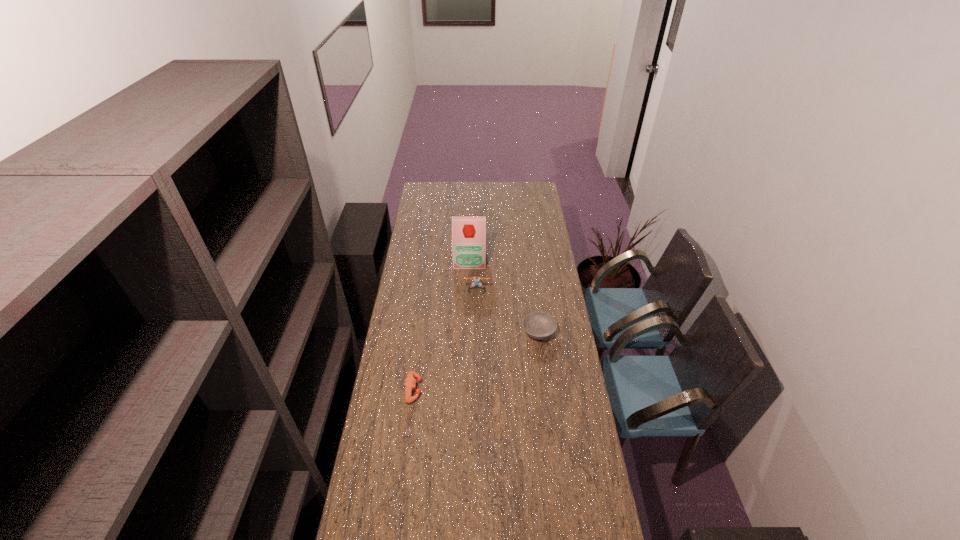
Where is `the tallest object`? the tallest object is located at coordinates (468, 232).

Image resolution: width=960 pixels, height=540 pixels. In order to click on soya milk in this screenshot , I will do `click(468, 232)`.

The width and height of the screenshot is (960, 540). I want to click on the third nearest object, so click(x=476, y=279).

The height and width of the screenshot is (540, 960). Identify the location of the right puncher. (476, 279).

Where is `bowl`? bowl is located at coordinates (538, 325).

Identify the location of the third farthest object. pyautogui.click(x=538, y=325).

The height and width of the screenshot is (540, 960). Find the location of `the shorter puncher`. the shorter puncher is located at coordinates (410, 382).

Where is `the nearer puncher`? Image resolution: width=960 pixels, height=540 pixels. the nearer puncher is located at coordinates (410, 382).

Identify the location of blank space located with the cap open on the farthest object. (468, 310).

Image resolution: width=960 pixels, height=540 pixels. Find the location of `vacant space located 0.390m on the front-facing side of the third shortest object`. vacant space located 0.390m on the front-facing side of the third shortest object is located at coordinates (476, 354).